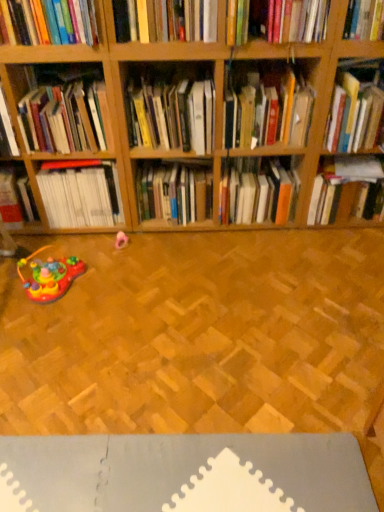
Question: Considering the relative sizes of hardcover book at upper right, placed as the first book when sorted from right to left, and hardcover book at upper center, the 8th book positioned from the right, in the image provided, is hardcover book at upper right, placed as the first book when sorted from right to left, taller than hardcover book at upper center, the 8th book positioned from the right,?

Choices:
 (A) yes
 (B) no

Answer: (A)

Question: Is hardcover book at upper right, placed as the first book when sorted from right to left, aimed at hardcover book at upper center, which ranks as the 5th book in left-to-right order?

Choices:
 (A) no
 (B) yes

Answer: (A)

Question: Is hardcover book at upper right, marked as the twelfth book in a left-to-right arrangement, placed right next to hardcover book at upper center, which ranks as the 5th book in left-to-right order?

Choices:
 (A) no
 (B) yes

Answer: (A)

Question: Would you say hardcover book at upper right, placed as the first book when sorted from right to left, contains hardcover book at upper center, the 8th book positioned from the right?

Choices:
 (A) yes
 (B) no

Answer: (B)

Question: Considering the relative positions of hardcover book at upper right, marked as the twelfth book in a left-to-right arrangement, and hardcover book at upper center, the 8th book positioned from the right, in the image provided, is hardcover book at upper right, marked as the twelfth book in a left-to-right arrangement, behind hardcover book at upper center, the 8th book positioned from the right,?

Choices:
 (A) yes
 (B) no

Answer: (A)

Question: Does hardcover book at upper right, marked as the twelfth book in a left-to-right arrangement, appear on the left side of hardcover book at upper center, which ranks as the 5th book in left-to-right order?

Choices:
 (A) no
 (B) yes

Answer: (A)

Question: Is rubberized plastic toy at lower left, which appears as the 2th toy when viewed from the top, at the left side of hardcover book at upper center, the 8th book positioned from the right?

Choices:
 (A) yes
 (B) no

Answer: (A)

Question: Is rubberized plastic toy at lower left, which is counted as the 1th toy, starting from the left, oriented towards hardcover book at upper center, the 8th book positioned from the right?

Choices:
 (A) yes
 (B) no

Answer: (B)

Question: Does rubberized plastic toy at lower left, positioned as the 2th toy in back-to-front order, have a lesser height compared to hardcover book at upper center, which ranks as the 5th book in left-to-right order?

Choices:
 (A) no
 (B) yes

Answer: (B)

Question: Does rubberized plastic toy at lower left, positioned as the 2th toy in back-to-front order, contain hardcover book at upper center, which ranks as the 5th book in left-to-right order?

Choices:
 (A) no
 (B) yes

Answer: (A)

Question: From the image's perspective, does rubberized plastic toy at lower left, which is counted as the 1th toy, starting from the left, appear higher than hardcover book at upper center, the 8th book positioned from the right?

Choices:
 (A) yes
 (B) no

Answer: (B)

Question: From the image's perspective, does rubberized plastic toy at lower left, the 1th toy when ordered from bottom to top, appear lower than hardcover book at upper center, which ranks as the 5th book in left-to-right order?

Choices:
 (A) no
 (B) yes

Answer: (B)

Question: Is hardcover book at upper center, the 8th book positioned from the right, bigger than hardcover book at center, arranged as the eighth book when viewed from the left?

Choices:
 (A) no
 (B) yes

Answer: (A)